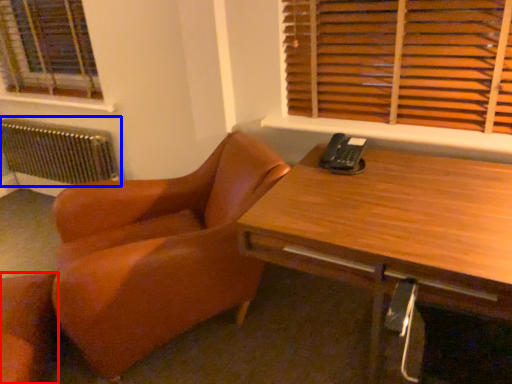
Question: Which of the following is the closest to the observer, chair (highlighted by a red box) or radiator (highlighted by a blue box)?

Choices:
 (A) chair
 (B) radiator

Answer: (A)